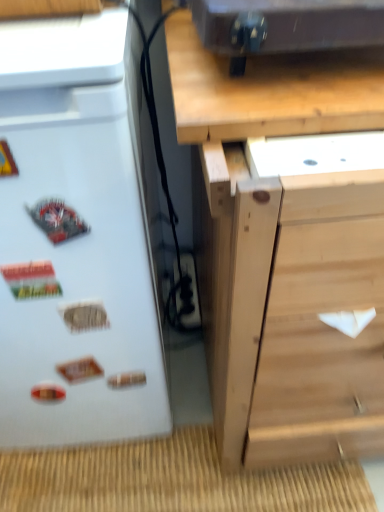
Question: Based on their sizes in the image, would you say metallic black speaker at upper center is bigger or smaller than white matte refrigerator at left?

Choices:
 (A) small
 (B) big

Answer: (A)

Question: Would you say metallic black speaker at upper center is to the left or to the right of white matte refrigerator at left in the picture?

Choices:
 (A) right
 (B) left

Answer: (A)

Question: Based on their relative distances, which object is farther from the metallic black speaker at upper center?

Choices:
 (A) black plastic electric outlet at lower center
 (B) white matte refrigerator at left
 (C) natural wood chest of drawers at center

Answer: (A)

Question: Based on their relative distances, which object is nearer to the natural wood chest of drawers at center?

Choices:
 (A) metallic black speaker at upper center
 (B) white matte refrigerator at left
 (C) black plastic electric outlet at lower center

Answer: (B)